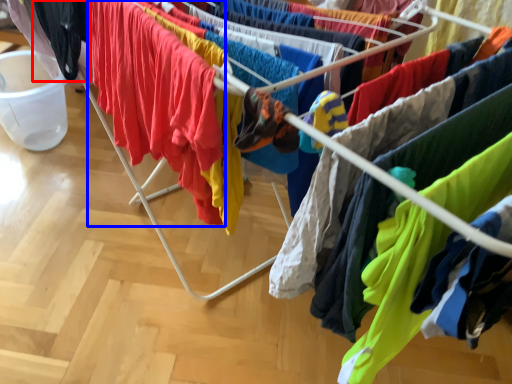
Question: Which object appears closest to the camera in this image, clothing (highlighted by a red box) or clothing (highlighted by a blue box)?

Choices:
 (A) clothing
 (B) clothing

Answer: (B)